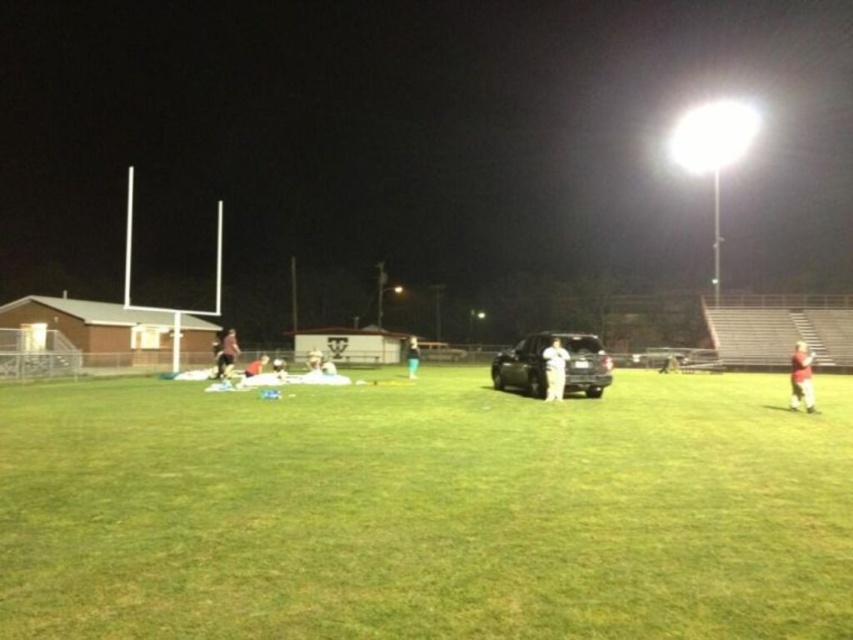
Question: Is green grass at center above white fabric bag at center?

Choices:
 (A) no
 (B) yes

Answer: (A)

Question: Is green grass at center to the right of white matte person at center from the viewer's perspective?

Choices:
 (A) yes
 (B) no

Answer: (B)

Question: Can you confirm if metallic car at center is wider than white matte person at center?

Choices:
 (A) no
 (B) yes

Answer: (B)

Question: Among these points, which one is farthest from the camera?

Choices:
 (A) (407, 342)
 (B) (549, 396)
 (C) (804, 385)
 (D) (352, 438)

Answer: (A)

Question: Which point appears closest to the camera in this image?

Choices:
 (A) (412, 342)
 (B) (276, 358)
 (C) (795, 387)

Answer: (C)

Question: Which point appears farthest from the camera in this image?

Choices:
 (A) (537, 394)
 (B) (231, 328)

Answer: (B)